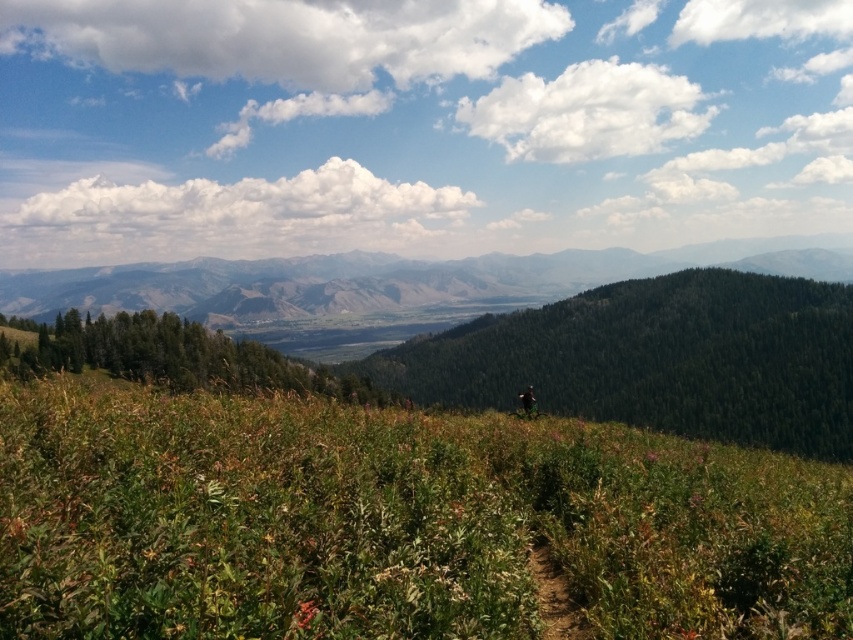
Question: Among these points, which one is farthest from the camera?

Choices:
 (A) (86, 588)
 (B) (671, 266)
 (C) (521, 400)

Answer: (B)

Question: Does green leafy grass at center appear on the right side of green matte jacket at center?

Choices:
 (A) no
 (B) yes

Answer: (A)

Question: Which object is positioned closest to the green forested mountain at center?

Choices:
 (A) green leafy grass at center
 (B) green matte jacket at center

Answer: (A)

Question: Is green leafy grass at center above green forested mountain at center?

Choices:
 (A) yes
 (B) no

Answer: (B)

Question: In this image, where is green leafy grass at center located relative to green forested mountain at center?

Choices:
 (A) above
 (B) below

Answer: (B)

Question: Estimate the real-world distances between objects in this image. Which object is closer to the green matte jacket at center?

Choices:
 (A) green forested mountain at center
 (B) green leafy grass at center

Answer: (B)